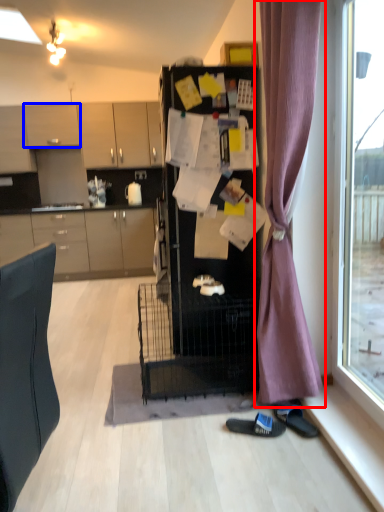
Question: Which object is closer to the camera taking this photo, curtain (highlighted by a red box) or cabinetry (highlighted by a blue box)?

Choices:
 (A) curtain
 (B) cabinetry

Answer: (A)